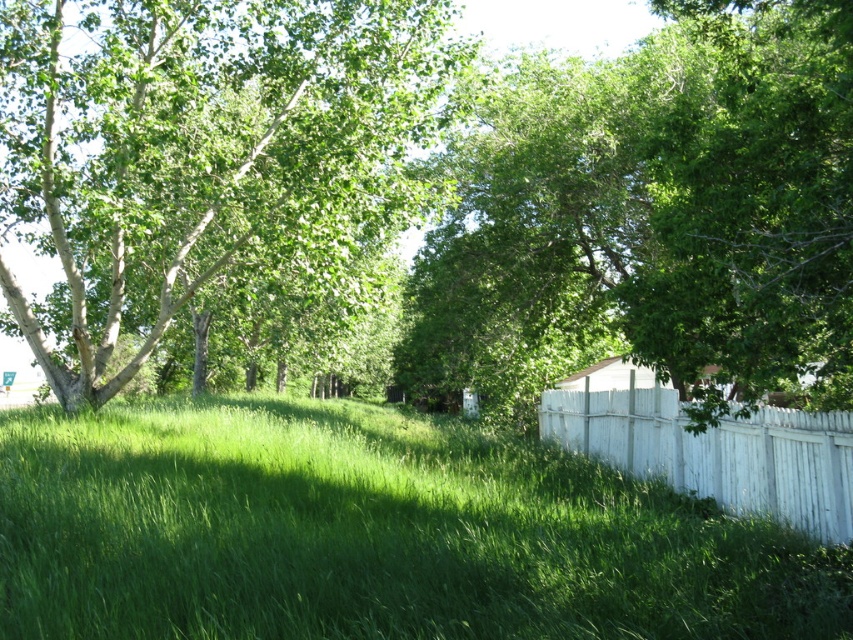
Question: Does green grassy at right have a lesser width compared to green leafy tree at center?

Choices:
 (A) yes
 (B) no

Answer: (B)

Question: Which point is farther to the camera?

Choices:
 (A) (161, 536)
 (B) (381, 227)
 (C) (531, 282)
 (D) (834, 513)

Answer: (C)

Question: Which point is farther from the camera taking this photo?

Choices:
 (A) (416, 461)
 (B) (323, 182)

Answer: (A)

Question: Is green leafy tree at center further to camera compared to white wooden fence at right?

Choices:
 (A) yes
 (B) no

Answer: (B)

Question: Is green grassy at right bigger than white wooden fence at right?

Choices:
 (A) yes
 (B) no

Answer: (A)

Question: Which point appears closest to the camera in this image?

Choices:
 (A) (666, 458)
 (B) (750, 83)
 (C) (184, 525)

Answer: (C)